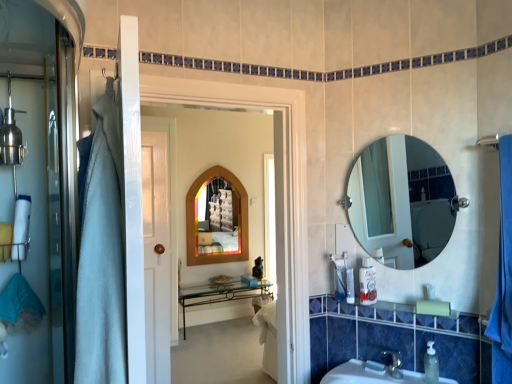
Question: From a real-world perspective, is wooden mirror at center positioned above or below clear glass mirror at upper right, which is the 1th mirror in front-to-back order?

Choices:
 (A) below
 (B) above

Answer: (A)

Question: From the image's perspective, is wooden mirror at center positioned above or below clear glass mirror at upper right, which appears as the 1th mirror when viewed from the right?

Choices:
 (A) below
 (B) above

Answer: (A)

Question: Which of these objects is positioned closest to the clear plastic soap dispenser at lower right, which is the first toiletry from front to back?

Choices:
 (A) white fabric towel at left
 (B) wooden mirror at center
 (C) translucent plastic soap at lower right
 (D) white plastic container at right, marked as the 2th toiletry in a back-to-front arrangement
 (E) white fabric bath towel at left

Answer: (C)

Question: Which object is positioned closest to the translucent plastic soap dispenser at lower right, the 2th toiletry viewed from the top?

Choices:
 (A) wooden-framed mirror at center, which appears as the 2th mirror when viewed from the right
 (B) clear glass mirror at upper right, which is the 2th mirror from back to front
 (C) translucent plastic soap at lower right
 (D) wooden mirror at center
 (E) clear plastic soap dispenser at lower right, which appears as the third toiletry when viewed from the left

Answer: (C)